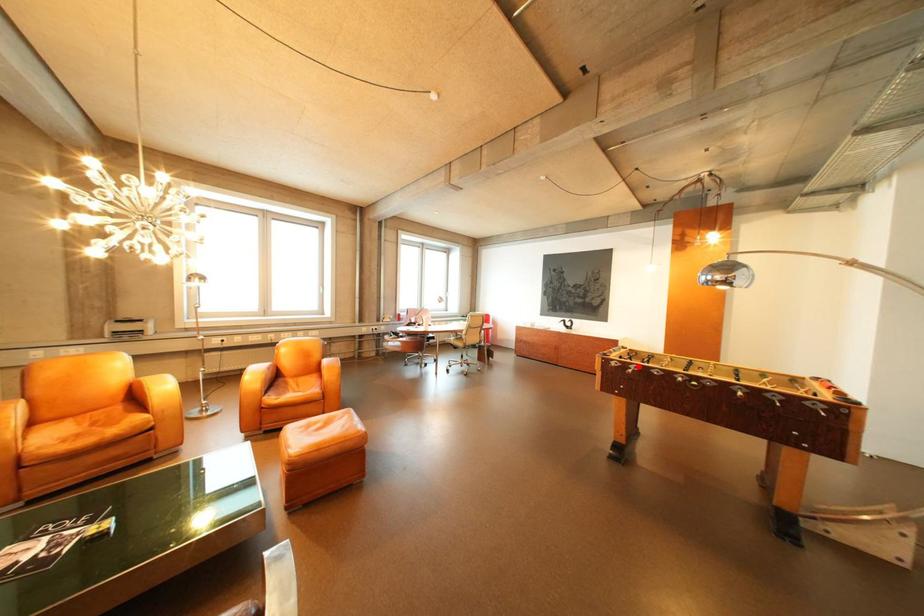
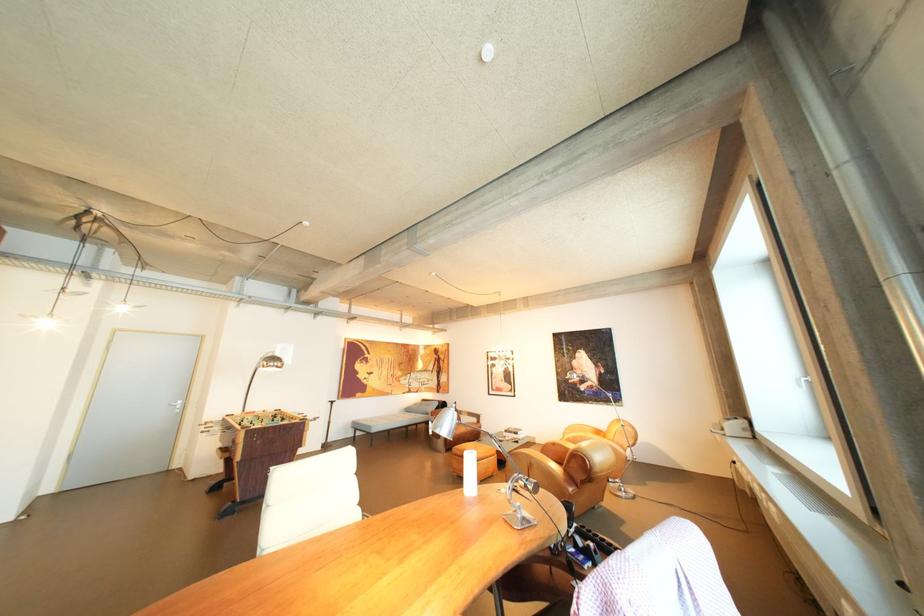
Question: I am providing you with two images of the same scene from different viewpoints. A red point is marked on the first image. At the location where the point appears in image 1, is it still visible in image 2?

Choices:
 (A) Yes
 (B) No

Answer: (B)